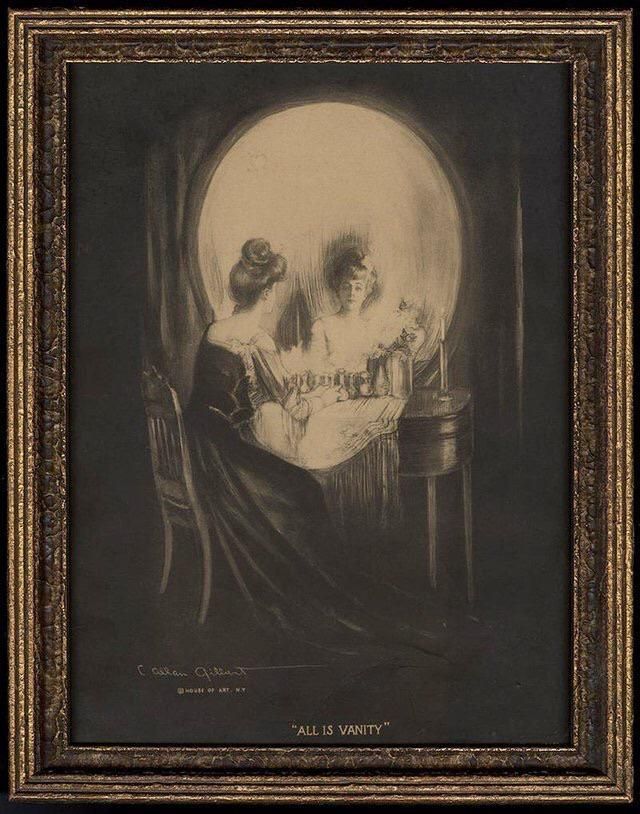
Where is `candle`? candle is located at coordinates (444, 316).